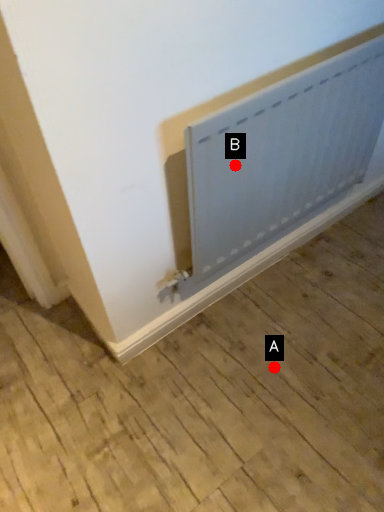
Question: Two points are circled on the image, labeled by A and B beside each circle. Which of the following is the closest to the observer?

Choices:
 (A) A is closer
 (B) B is closer

Answer: (B)